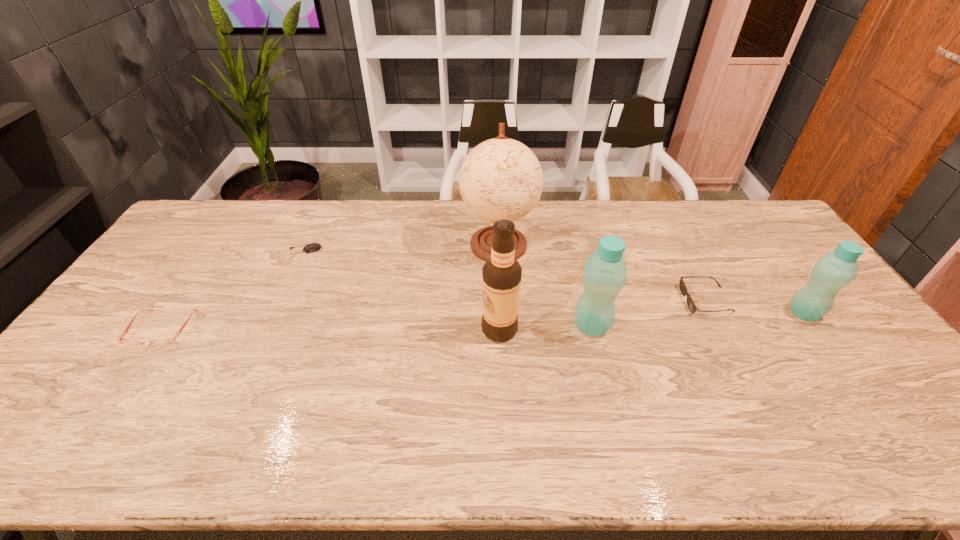
Where is `vacant space that's between the spectacles and the globe`? This screenshot has height=540, width=960. vacant space that's between the spectacles and the globe is located at coordinates (330, 287).

I want to click on vacant space in between the globe and the right bottle, so click(652, 279).

Locate an element on the screen. The height and width of the screenshot is (540, 960). free spot between the fifth shortest object and the fourth tallest object is located at coordinates (698, 320).

Find the location of `vacant point located between the sixth object from left to right and the leftmost object`. vacant point located between the sixth object from left to right and the leftmost object is located at coordinates (434, 315).

At what (x,y) coordinates should I click in order to perform the action: click on free spot between the alcohol and the sixth object from right to left. Please return your answer as a coordinate pair (x, y). This screenshot has height=540, width=960. Looking at the image, I should click on (402, 289).

The width and height of the screenshot is (960, 540). What are the coordinates of `vacant space in between the second object from right to left and the right bottle` in the screenshot? It's located at (755, 307).

This screenshot has width=960, height=540. Identify the location of vacant area that lies between the shortest object and the leftmost object. (233, 289).

The image size is (960, 540). In order to click on blank region between the alcohol and the taller bottle in this screenshot , I will do `click(545, 327)`.

Identify which object is the third nearest to the rightmost object. Please provide its 2D coordinates. Your answer should be formatted as a tuple, i.e. [(x, y)], where the tuple contains the x and y coordinates of a point satisfying the conditions above.

[(501, 178)]

At what (x,y) coordinates should I click in order to perform the action: click on the fourth closest object to the leftmost object. Please return your answer as a coordinate pair (x, y). Looking at the image, I should click on click(x=605, y=273).